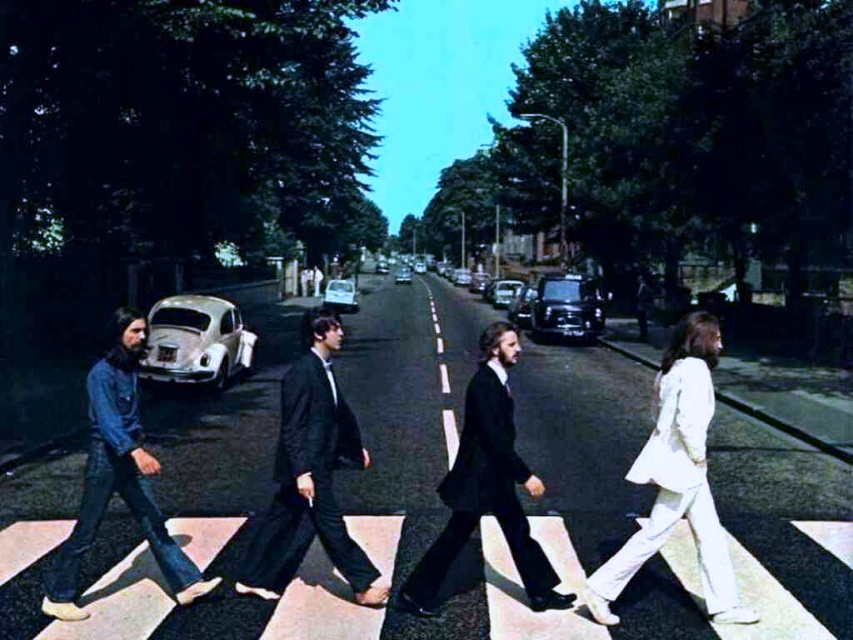
Question: Which of the following is the closest to the observer?

Choices:
 (A) (340, 541)
 (B) (73, 579)

Answer: (B)

Question: Can you confirm if black suit at center is bigger than denim jacket at left?

Choices:
 (A) no
 (B) yes

Answer: (A)

Question: Can you confirm if black textured suit at center is positioned to the right of black suit at center?

Choices:
 (A) no
 (B) yes

Answer: (A)

Question: Is black textured suit at center wider than denim jacket at left?

Choices:
 (A) no
 (B) yes

Answer: (A)

Question: Which of the following is the closest to the observer?

Choices:
 (A) (102, 392)
 (B) (341, 452)
 (C) (467, 388)

Answer: (A)

Question: Which of the following is the closest to the observer?

Choices:
 (A) black suit at center
 (B) denim jacket at left

Answer: (B)